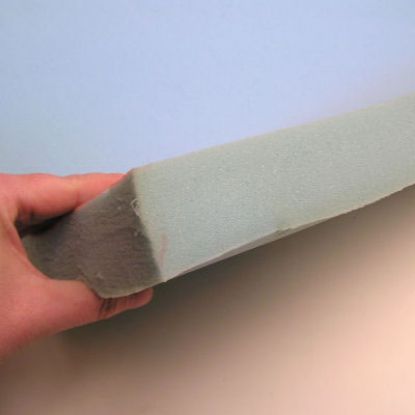
This screenshot has height=415, width=415. I want to click on blue part of the wall, so click(x=215, y=107).